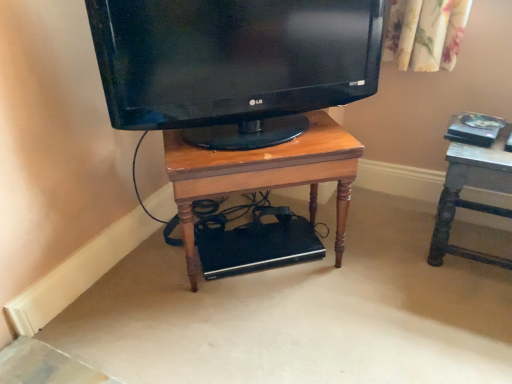
At what (x,y) coordinates should I click in order to perform the action: click on blank space above wooden desk at center (from a real-world perspective). Please return your answer as a coordinate pair (x, y). Looking at the image, I should click on (259, 139).